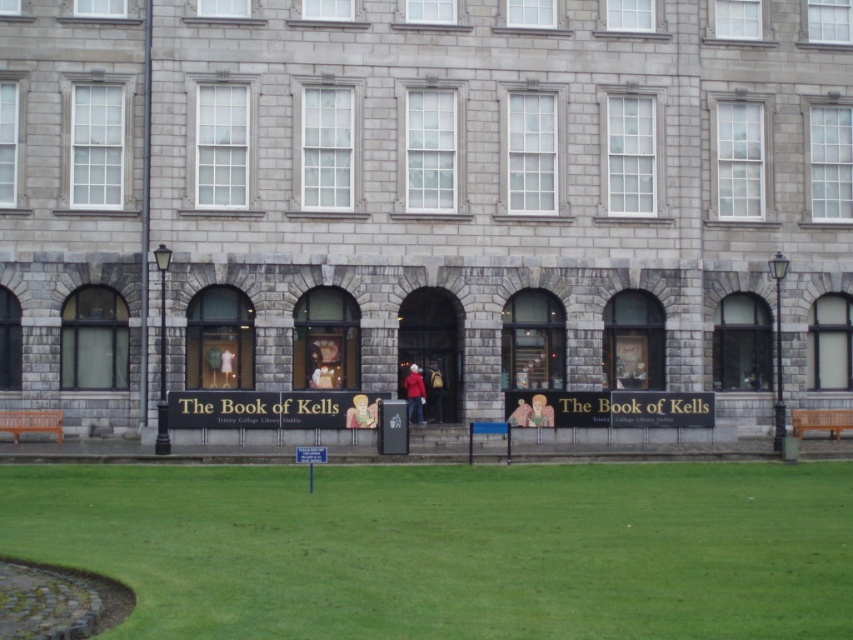
You are standing in front of the historic stone building and see the green grass at lower center and the matte yellow figure at center. Which object is closer to you?

The matte yellow figure at center is closer to you because it is shorter than the green grass at lower center, which is taller and likely further away.

You are standing in front of the historic stone building and notice a matte red jacket at center and a matte yellow figure at center. From your perspective, which object is positioned to the left?

The matte red jacket at center is positioned to the left of the matte yellow figure at center.